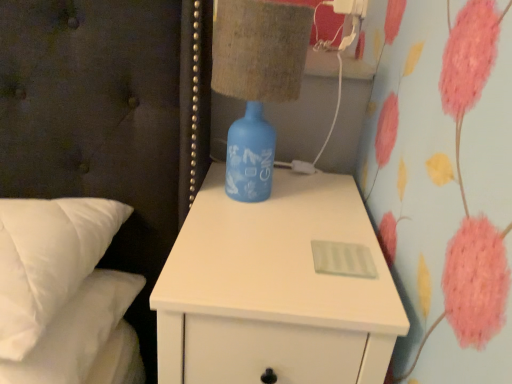
Find the location of `vacant area in front of blue glass bottle at upper right`. vacant area in front of blue glass bottle at upper right is located at coordinates (266, 233).